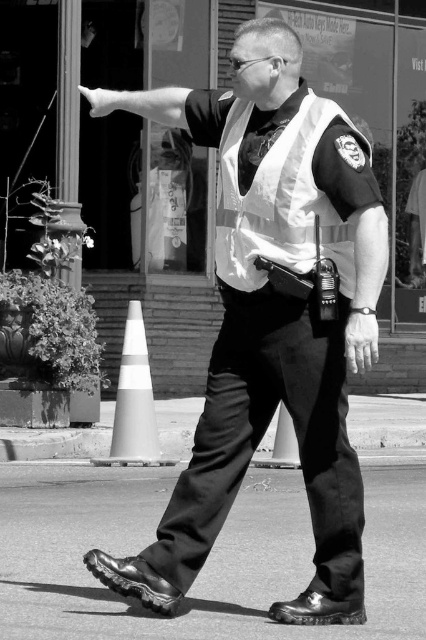
Question: Estimate the real-world distances between objects in this image. Which object is closer to the matte black vest at center?

Choices:
 (A) shiny asphalt at lower center
 (B) metallic radio at upper right

Answer: (B)

Question: Can you confirm if smooth skin hand at center is thinner than matte black hand at upper left?

Choices:
 (A) yes
 (B) no

Answer: (A)

Question: Is matte black vest at center thinner than metallic radio at upper right?

Choices:
 (A) yes
 (B) no

Answer: (B)

Question: Does shiny asphalt at lower center lie in front of matte black hand at upper left?

Choices:
 (A) no
 (B) yes

Answer: (A)

Question: Which object is positioned closest to the white reflective cone at lower left?

Choices:
 (A) matte black arm at upper left
 (B) metallic radio at upper right
 (C) shiny asphalt at lower center

Answer: (C)

Question: Which point is farther to the camera?

Choices:
 (A) (155, 433)
 (B) (351, 312)
 (C) (275, 259)

Answer: (A)